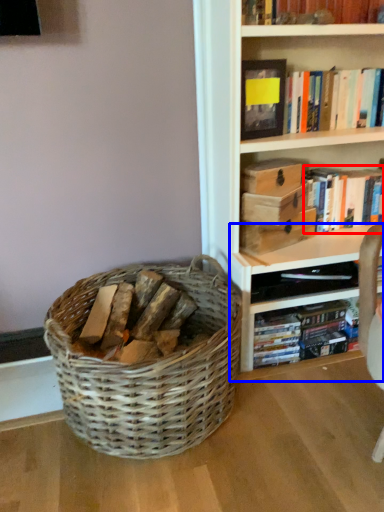
Question: Which object is closer to the camera taking this photo, book (highlighted by a red box) or shelf (highlighted by a blue box)?

Choices:
 (A) book
 (B) shelf

Answer: (B)